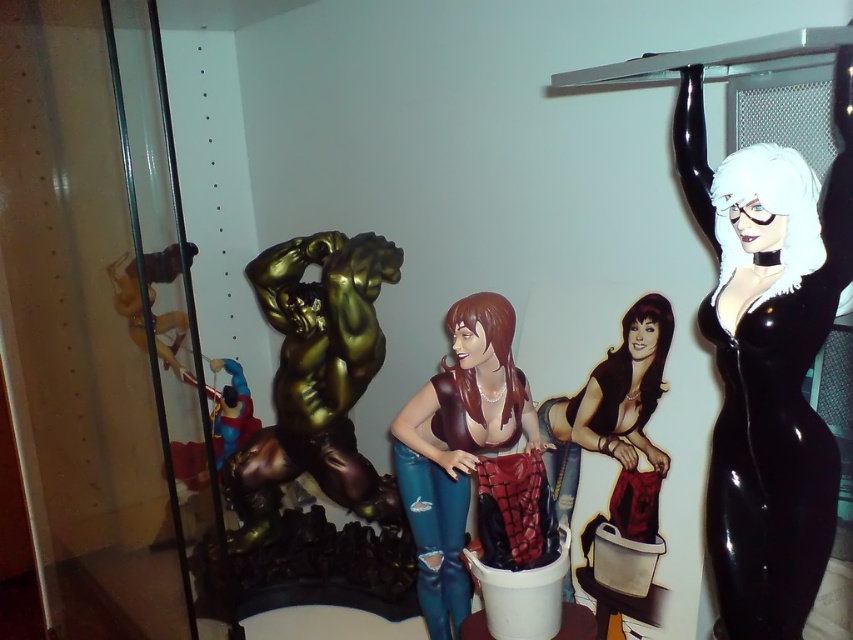
Question: Can you confirm if glossy black figure at upper right is smaller than matte black figure at center?

Choices:
 (A) no
 (B) yes

Answer: (A)

Question: Which point appears closest to the camera in this image?

Choices:
 (A) (788, 628)
 (B) (234, 371)
 (C) (134, 259)

Answer: (A)

Question: Is glossy black figure at upper right smaller than matte brown hair at center?

Choices:
 (A) no
 (B) yes

Answer: (B)

Question: Which object is the farthest from the glossy black figure at upper right?

Choices:
 (A) matte blue plastic toy at left
 (B) matte black figure at center
 (C) matte brown hair at center
 (D) shiny gold figure at center

Answer: (A)

Question: Where is glossy black figure at upper right located in relation to gold metallic statue at center-left in the image?

Choices:
 (A) left
 (B) right

Answer: (B)

Question: Which point is closer to the camera taking this photo?

Choices:
 (A) tap(235, 378)
 (B) tap(334, 412)
 (C) tap(727, 332)
 (D) tap(546, 464)

Answer: (C)